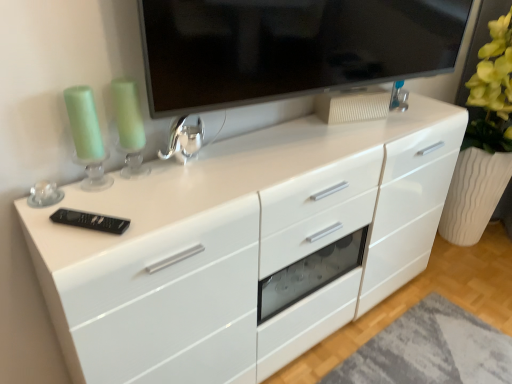
Find the location of `vacant space that's between black plastic remote at lower left, positioned as the second appliance in back-to-front order, and shiny metallic faucet at center, which appears as the 2th appliance when viewed from the left`. vacant space that's between black plastic remote at lower left, positioned as the second appliance in back-to-front order, and shiny metallic faucet at center, which appears as the 2th appliance when viewed from the left is located at coordinates (138, 198).